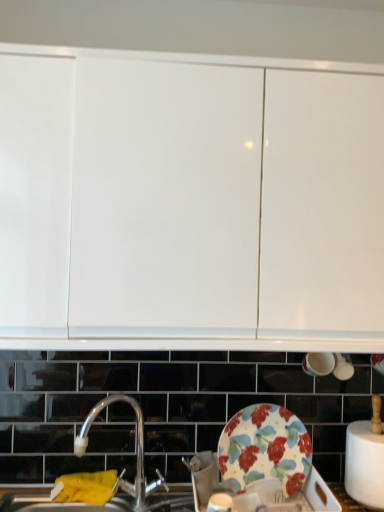
Question: Can you confirm if silver metallic tap at center is wider than yellow fabric at lower left?

Choices:
 (A) no
 (B) yes

Answer: (B)

Question: Is silver metallic tap at center located outside yellow fabric at lower left?

Choices:
 (A) no
 (B) yes

Answer: (B)

Question: Are silver metallic tap at center and yellow fabric at lower left making contact?

Choices:
 (A) yes
 (B) no

Answer: (B)

Question: Is silver metallic tap at center turned away from yellow fabric at lower left?

Choices:
 (A) yes
 (B) no

Answer: (B)

Question: From the image's perspective, is silver metallic tap at center under yellow fabric at lower left?

Choices:
 (A) yes
 (B) no

Answer: (B)

Question: Is floral-patterned ceramic plate at lower center bigger or smaller than yellow fabric at lower left?

Choices:
 (A) small
 (B) big

Answer: (A)

Question: Is point (266, 402) positioned closer to the camera than point (96, 480)?

Choices:
 (A) farther
 (B) closer

Answer: (A)

Question: Choose the correct answer: Is floral-patterned ceramic plate at lower center inside yellow fabric at lower left or outside it?

Choices:
 (A) inside
 (B) outside

Answer: (B)

Question: Is floral-patterned ceramic plate at lower center taller or shorter than yellow fabric at lower left?

Choices:
 (A) short
 (B) tall

Answer: (B)

Question: Looking at their shapes, would you say floral-patterned ceramic plate at lower center is wider or thinner than white glossy cabinet at upper center?

Choices:
 (A) thin
 (B) wide

Answer: (A)

Question: Considering their positions, is floral-patterned ceramic plate at lower center located in front of or behind white glossy cabinet at upper center?

Choices:
 (A) behind
 (B) front

Answer: (A)

Question: From a real-world perspective, is floral-patterned ceramic plate at lower center above or below white glossy cabinet at upper center?

Choices:
 (A) above
 (B) below

Answer: (B)

Question: Would you say floral-patterned ceramic plate at lower center is to the left or to the right of white glossy cabinet at upper center in the picture?

Choices:
 (A) right
 (B) left

Answer: (A)

Question: Looking at their shapes, would you say floral-patterned ceramic plate at lower center is wider or thinner than silver metallic tap at center?

Choices:
 (A) thin
 (B) wide

Answer: (A)

Question: Considering the positions of floral-patterned ceramic plate at lower center and silver metallic tap at center in the image, is floral-patterned ceramic plate at lower center taller or shorter than silver metallic tap at center?

Choices:
 (A) tall
 (B) short

Answer: (B)